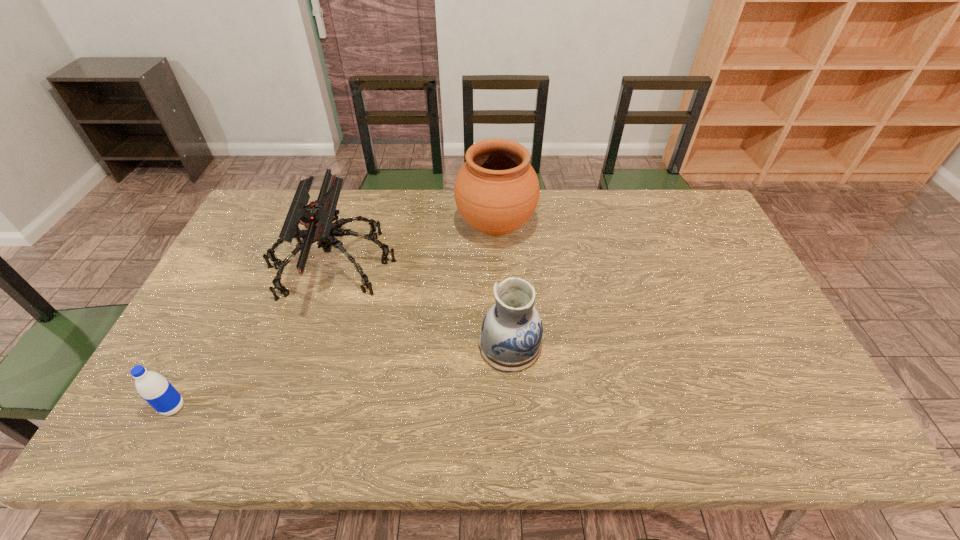
At what (x,y) coordinates should I click in order to perform the action: click on free point that satisfies the following two spatial constraints: 1. on the back side of the drone; 2. on the left side of the taller pottery. Please return your answer as a coordinate pair (x, y). The image size is (960, 540). Looking at the image, I should click on tap(345, 226).

In order to click on vacant space that satisfies the following two spatial constraints: 1. on the back side of the nearest object; 2. on the left side of the taller pottery in this screenshot , I will do `click(268, 226)`.

Find the location of a particular element. free spot that satisfies the following two spatial constraints: 1. on the front side of the shorter pottery; 2. on the left side of the farther pottery is located at coordinates (500, 345).